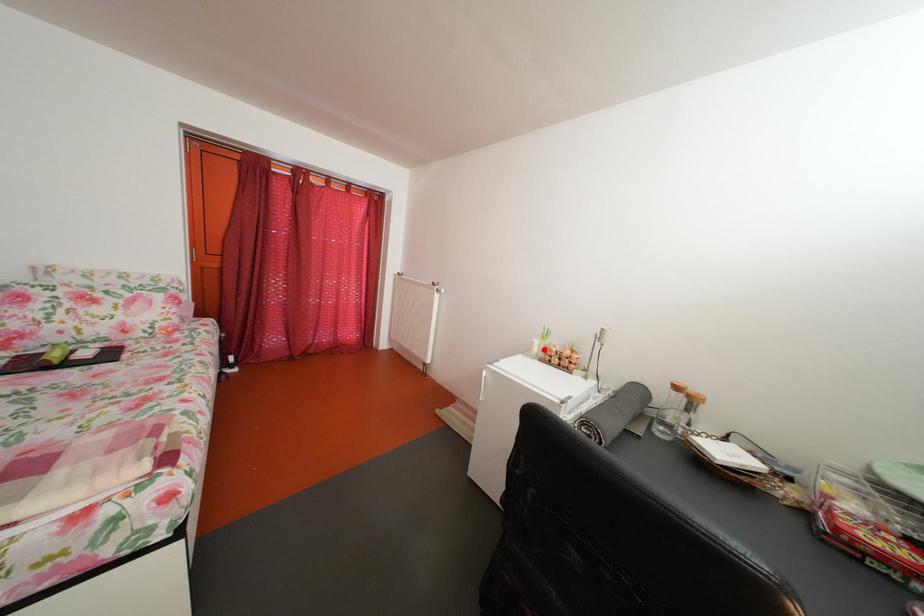
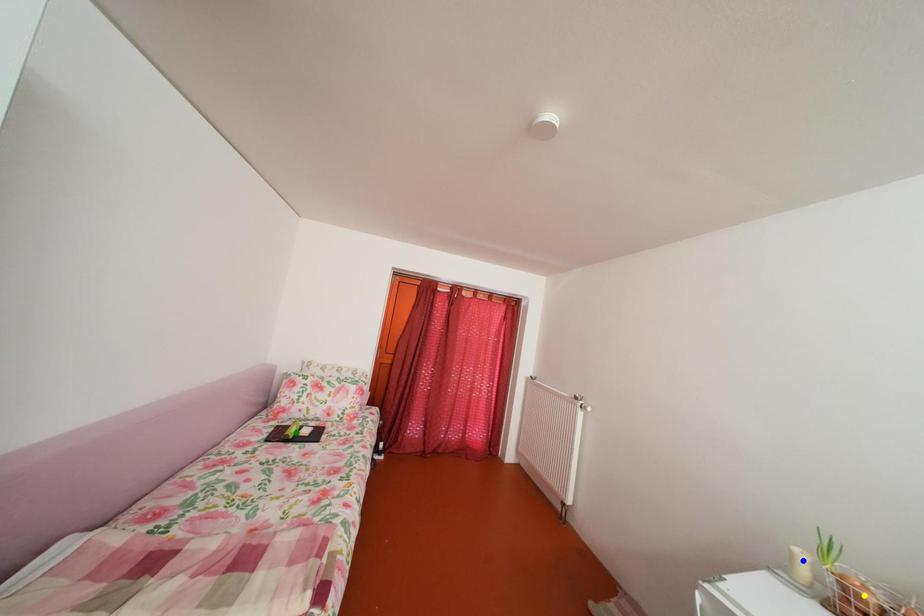
Question: I am providing you with two images of the same scene from different viewpoints. A red point is marked on the first image. You are given multiple points on the second image. Which point in image 2 is actually the same real-world point as the red point in image 1?

Choices:
 (A) yellow point
 (B) blue point
 (C) green point

Answer: (B)